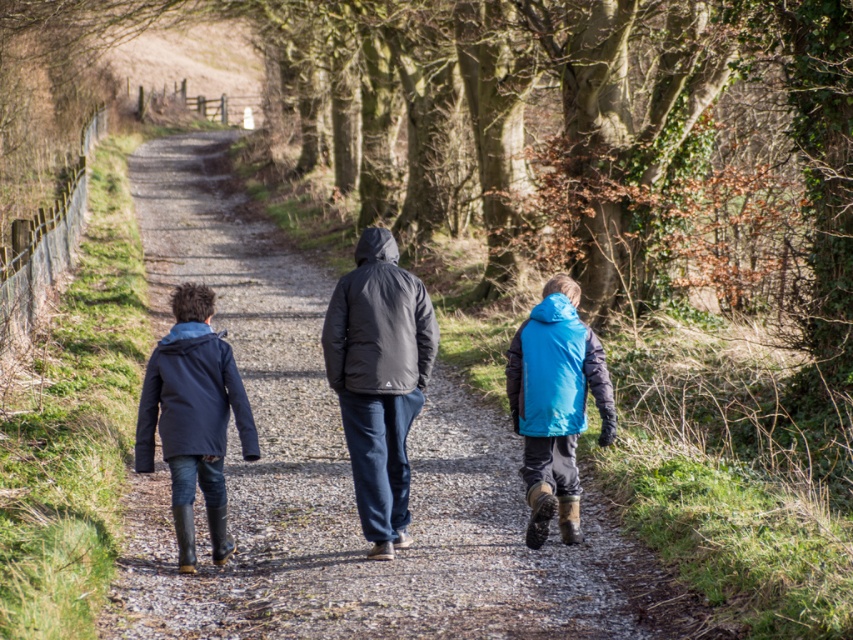
Which is behind, point (165, 170) or point (146, 452)?

Positioned behind is point (165, 170).

Which is in front, point (415, 504) or point (148, 470)?

Positioned in front is point (148, 470).

Locate an element on the screen. matte black jacket at center is located at coordinates (334, 467).

Is dark gray puffer jacket at center wider than matte blue jacket at left?

No.

Is dark gray puffer jacket at center to the left of matte blue jacket at left from the viewer's perspective?

Incorrect, dark gray puffer jacket at center is not on the left side of matte blue jacket at left.

Identify the location of dark gray puffer jacket at center. The height and width of the screenshot is (640, 853). (379, 378).

Who is positioned more to the left, matte black jacket at center or blue synthetic jacket at lower right?

From the viewer's perspective, matte black jacket at center appears more on the left side.

Does matte black jacket at center appear under blue synthetic jacket at lower right?

No, matte black jacket at center is not below blue synthetic jacket at lower right.

The image size is (853, 640). What are the coordinates of `matte black jacket at center` in the screenshot? It's located at pos(334,467).

Where is `matte black jacket at center`? matte black jacket at center is located at coordinates (334, 467).